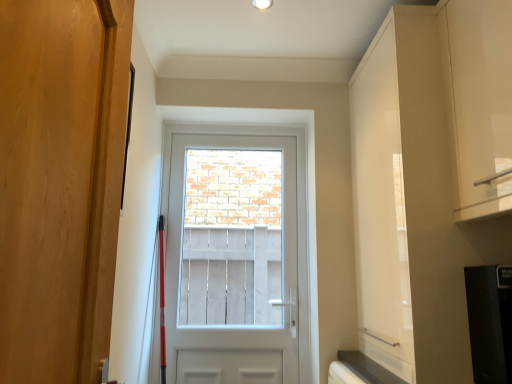
Question: From a real-world perspective, is white glossy cabinet at upper right on wooden door at left, positioned as the 1th door in front-to-back order?

Choices:
 (A) yes
 (B) no

Answer: (A)

Question: Is white glossy cabinet at upper right thinner than wooden door at left, the second door from the back?

Choices:
 (A) yes
 (B) no

Answer: (B)

Question: Is white glossy cabinet at upper right closer to camera compared to wooden door at left, positioned as the 1th door in front-to-back order?

Choices:
 (A) no
 (B) yes

Answer: (A)

Question: Is white glossy cabinet at upper right next to wooden door at left, positioned as the 1th door in front-to-back order, and touching it?

Choices:
 (A) yes
 (B) no

Answer: (B)

Question: Can you confirm if white glossy cabinet at upper right is bigger than wooden door at left, the second door from the back?

Choices:
 (A) no
 (B) yes

Answer: (B)

Question: Considering the relative sizes of white glossy cabinet at upper right and wooden door at left, positioned as the 1th door in front-to-back order, in the image provided, is white glossy cabinet at upper right smaller than wooden door at left, positioned as the 1th door in front-to-back order,?

Choices:
 (A) yes
 (B) no

Answer: (B)

Question: Is white wooden screen at center positioned before white glossy door at center, the second door from the front?

Choices:
 (A) yes
 (B) no

Answer: (B)

Question: Is white wooden screen at center smaller than white glossy door at center, the first door from the back?

Choices:
 (A) no
 (B) yes

Answer: (B)

Question: Is white wooden screen at center to the left of white glossy door at center, the second door from the front, from the viewer's perspective?

Choices:
 (A) yes
 (B) no

Answer: (A)

Question: From a real-world perspective, is white wooden screen at center below white glossy door at center, the second door from the front?

Choices:
 (A) no
 (B) yes

Answer: (A)

Question: From a real-world perspective, is white wooden screen at center physically above white glossy door at center, the first door from the back?

Choices:
 (A) yes
 (B) no

Answer: (A)

Question: From the image's perspective, is white wooden screen at center located above white glossy door at center, the first door from the back?

Choices:
 (A) yes
 (B) no

Answer: (A)

Question: Is wooden door at left, positioned as the 1th door in front-to-back order, aimed at white glossy door at center, the second door from the front?

Choices:
 (A) no
 (B) yes

Answer: (A)